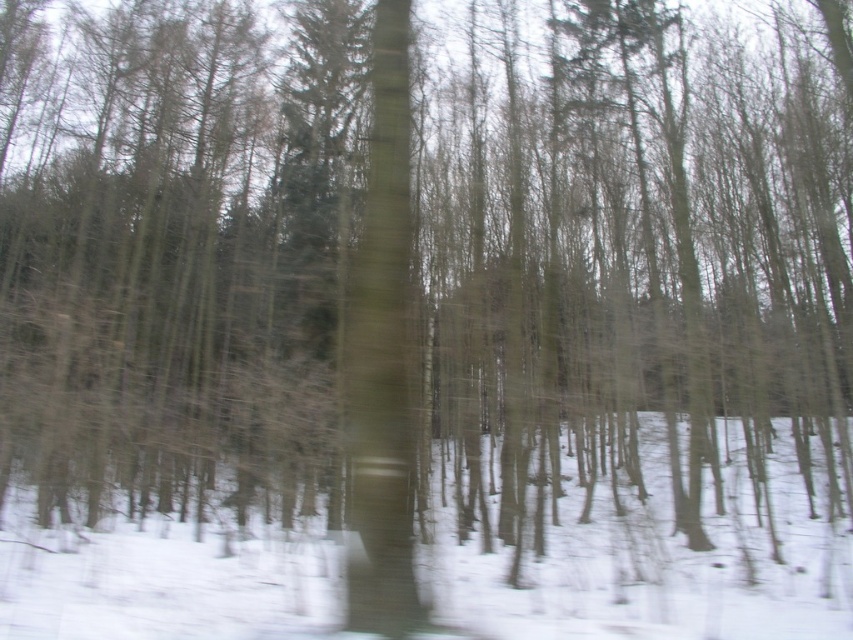
Between point (270, 576) and point (380, 32), which one is positioned behind?

The point (270, 576) is more distant.

Identify the location of white powdery snow at center. The image size is (853, 640). (653, 556).

Locate an element on the screen. white powdery snow at center is located at coordinates (653, 556).